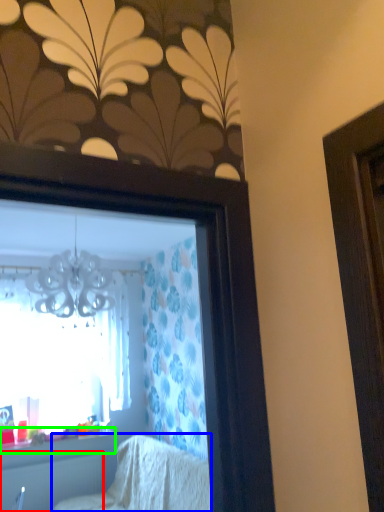
Question: Estimate the real-world distances between objects in this image. Which object is closer to radiator (highlighted by a red box), furniture (highlighted by a blue box) or window sill (highlighted by a green box)?

Choices:
 (A) furniture
 (B) window sill

Answer: (B)